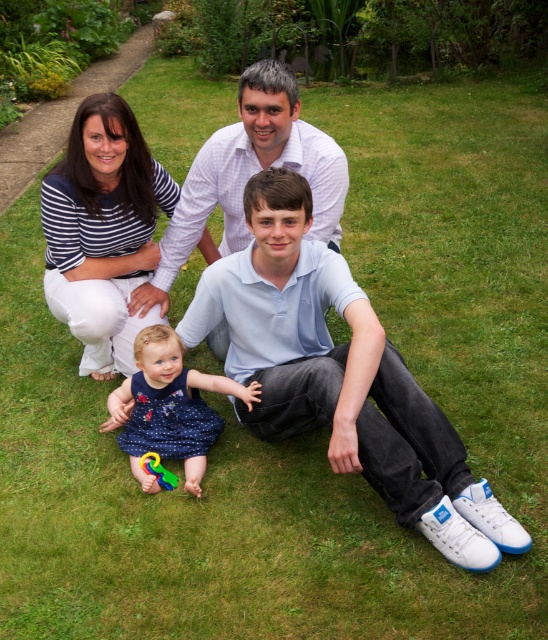
Question: Is dark blue satin dress at center above rubberized plastic toy at lower center?

Choices:
 (A) no
 (B) yes

Answer: (B)

Question: Among these objects, which one is farthest from the camera?

Choices:
 (A) white cotton shirt at center
 (B) rubberized plastic toy at lower center
 (C) dark blue satin dress at center

Answer: (B)

Question: Is white striped shirt at center positioned behind dark blue satin dress at center?

Choices:
 (A) yes
 (B) no

Answer: (A)

Question: Among these objects, which one is farthest from the camera?

Choices:
 (A) white cotton shirt at center
 (B) striped cotton shirt at center
 (C) rubberized plastic toy at lower center

Answer: (B)

Question: Is the position of dark blue satin dress at center less distant than that of rubberized plastic toy at lower center?

Choices:
 (A) yes
 (B) no

Answer: (A)

Question: Which point appears closest to the camera in this image?

Choices:
 (A) 195,460
 (B) 231,193

Answer: (A)